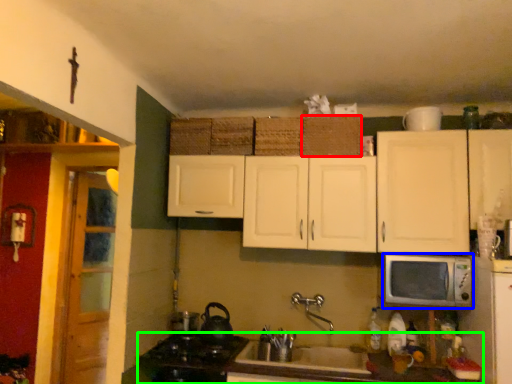
Question: Which is nearer to the basket (highlighted by a red box)? microwave oven (highlighted by a blue box) or countertop (highlighted by a green box).

Choices:
 (A) microwave oven
 (B) countertop

Answer: (A)